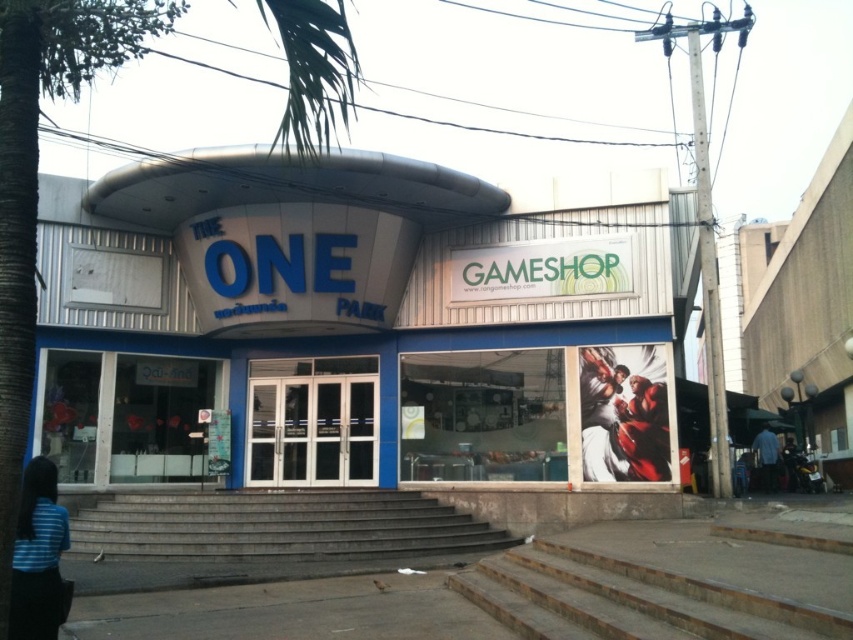
Does green leafy palm tree at upper left appear over red glossy figure at center?

Indeed, green leafy palm tree at upper left is positioned over red glossy figure at center.

Does point (113, 61) come in front of point (641, 435)?

Yes, point (113, 61) is closer to viewer.

Image resolution: width=853 pixels, height=640 pixels. Identify the location of green leafy palm tree at upper left. (36, 182).

Is point (625, 472) positioned before point (776, 484)?

Yes, it is in front of point (776, 484).

Is smooth canvas figure at right positioned at the back of blue fabric shirt at lower right?

No, it is in front of blue fabric shirt at lower right.

This screenshot has width=853, height=640. Find the location of `smooth canvas figure at right`. smooth canvas figure at right is located at coordinates (601, 413).

How much distance is there between gray concrete stairs at lower center and red glossy figure at center?

A distance of 3.52 meters exists between gray concrete stairs at lower center and red glossy figure at center.

Who is taller, gray concrete stairs at lower center or red glossy figure at center?

With more height is red glossy figure at center.

Is point (97, 545) positioned behind point (641, 408)?

No.

You are a GUI agent. You are given a task and a screenshot of the screen. Output one action in this format:
    pyautogui.click(x=<x>, y=<y>)
    Task: Click on the gray concrete stairs at lower center
    
    Given the screenshot: What is the action you would take?
    pyautogui.click(x=280, y=525)